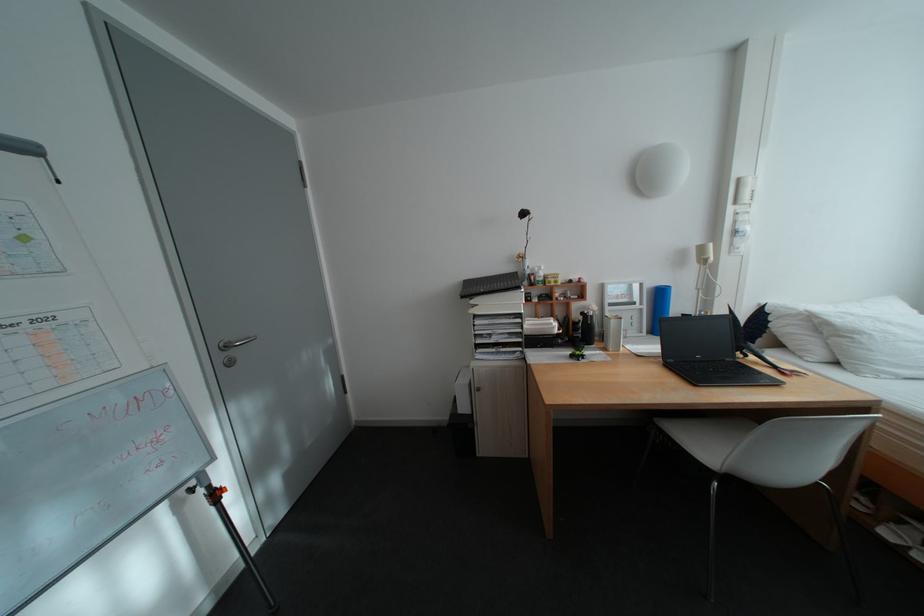
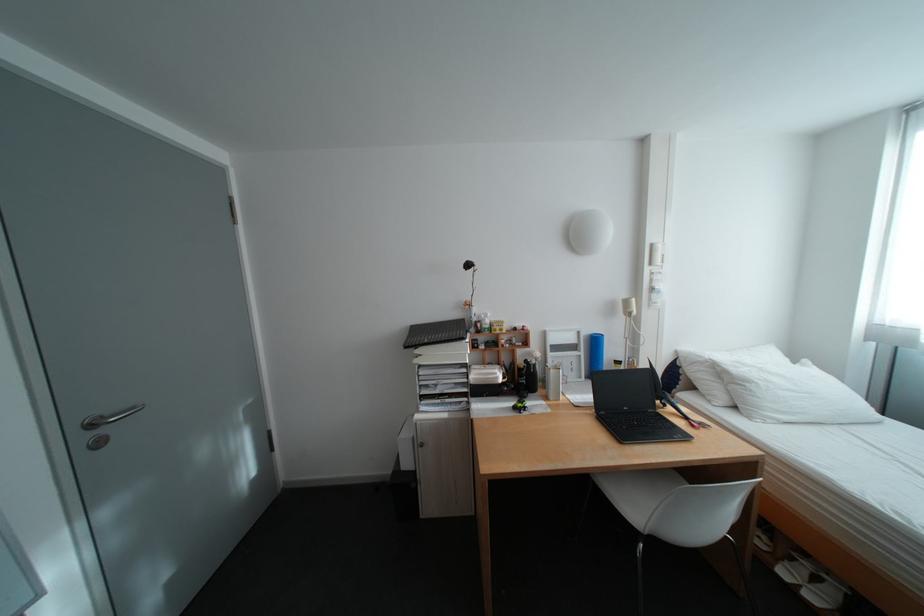
Where in the second image is the point corresponding to point 751,180 from the first image?

(664, 246)